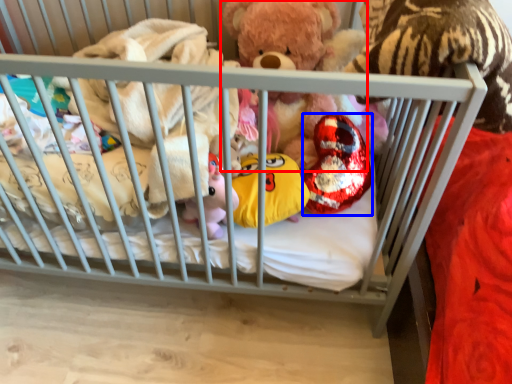
Question: Which point is further to the camera, teddy bear (highlighted by a red box) or toy (highlighted by a blue box)?

Choices:
 (A) teddy bear
 (B) toy

Answer: (B)